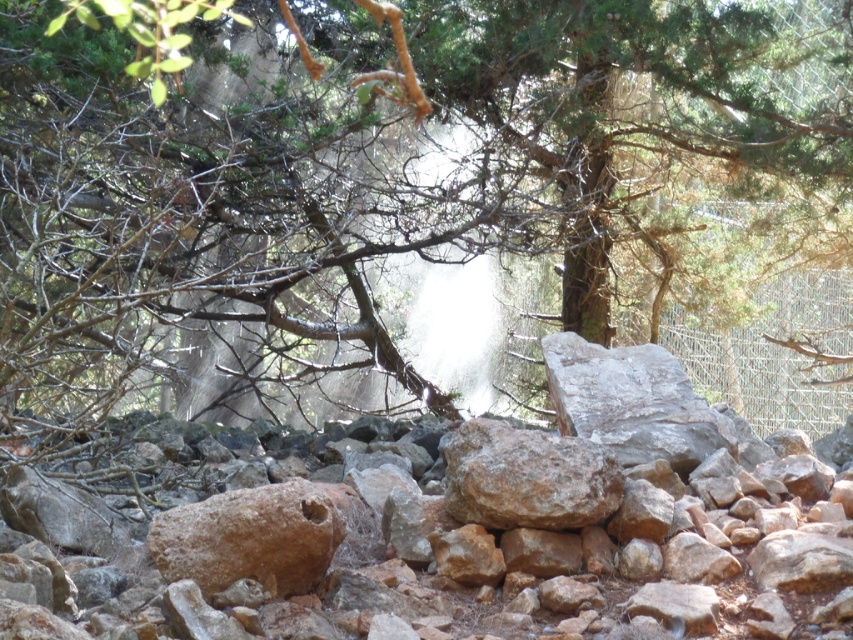
Question: Which object is the farthest from the brown rough rock at center?

Choices:
 (A) green textured tree at center
 (B) rusty stone at center

Answer: (A)

Question: Is rusty stone at center smaller than brown rough rock at center?

Choices:
 (A) no
 (B) yes

Answer: (A)

Question: Is rusty stone at center closer to the viewer compared to brown rough rock at center?

Choices:
 (A) no
 (B) yes

Answer: (B)

Question: Which point is closer to the camera taking this photo?

Choices:
 (A) (154, 548)
 (B) (515, 451)

Answer: (A)

Question: Which object is the farthest from the rusty stone at center?

Choices:
 (A) green textured tree at center
 (B) brown rough rock at center

Answer: (A)

Question: Can you confirm if green textured tree at center is bigger than rusty stone at center?

Choices:
 (A) no
 (B) yes

Answer: (B)